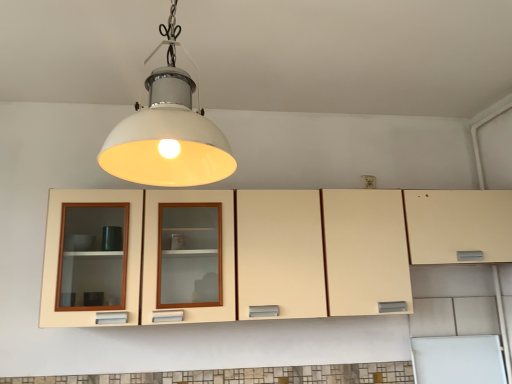
Question: Considering the positions of white matte lampshade at center and matte cream cabinet at center in the image, is white matte lampshade at center bigger or smaller than matte cream cabinet at center?

Choices:
 (A) big
 (B) small

Answer: (B)

Question: Looking at their shapes, would you say white matte lampshade at center is wider or thinner than matte cream cabinet at center?

Choices:
 (A) wide
 (B) thin

Answer: (A)

Question: Visually, is white matte lampshade at center positioned to the left or to the right of matte cream cabinet at center?

Choices:
 (A) left
 (B) right

Answer: (A)

Question: Considering their positions, is matte cream cabinet at center located in front of or behind white matte lampshade at center?

Choices:
 (A) front
 (B) behind

Answer: (B)

Question: Is matte cream cabinet at center situated inside white matte lampshade at center or outside?

Choices:
 (A) inside
 (B) outside

Answer: (B)

Question: From a real-world perspective, is matte cream cabinet at center physically located above or below white matte lampshade at center?

Choices:
 (A) below
 (B) above

Answer: (A)

Question: Based on their positions, is matte cream cabinet at center located to the left or right of white matte lampshade at center?

Choices:
 (A) right
 (B) left

Answer: (A)